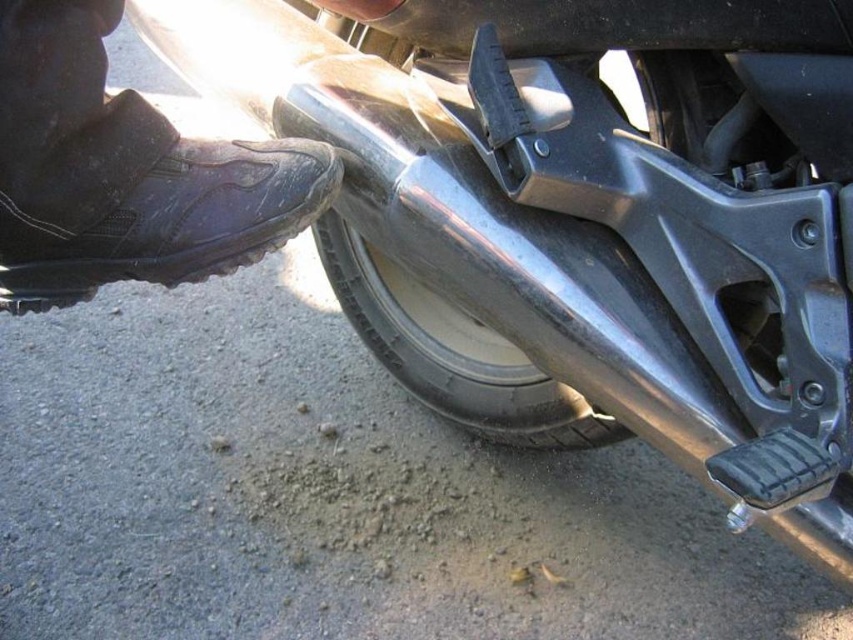
Is point (7, 264) more distant than point (566, 410)?

No, (7, 264) is closer to viewer.

Which of these two, black leather boot at lower left or shiny metallic tire at lower center, stands taller?

Standing taller between the two is shiny metallic tire at lower center.

Which is in front, point (13, 266) or point (357, 328)?

Positioned in front is point (13, 266).

The image size is (853, 640). What are the coordinates of `black leather boot at lower left` in the screenshot? It's located at (161, 216).